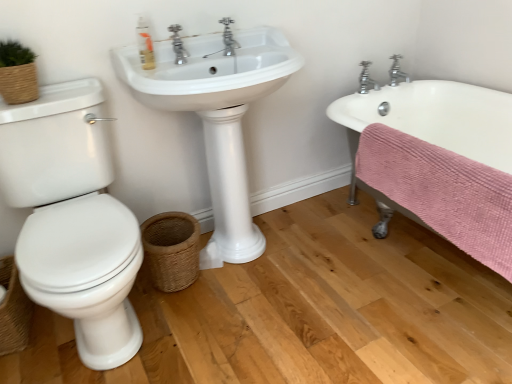
Question: In terms of size, does woven brown basket at lower center, arranged as the 2th basket when viewed from the left, appear bigger or smaller than chrome metallic faucet at upper right, which appears as the 3th tap when viewed from the front?

Choices:
 (A) big
 (B) small

Answer: (A)

Question: In terms of width, does woven brown basket at lower center, arranged as the 2th basket when viewed from the left, look wider or thinner when compared to chrome metallic faucet at upper right, which appears as the 3th tap when viewed from the front?

Choices:
 (A) wide
 (B) thin

Answer: (A)

Question: Which is farther from the chrome metallic faucet at upper center, the 3th tap when ordered from right to left?

Choices:
 (A) chrome metallic faucet at upper right, which is counted as the 3th tap, starting from the left
 (B) woven brown basket at lower left, which is the 1th basket in left-to-right order
 (C) pink textured towel at lower right
 (D) woven brown basket at lower center, arranged as the 2th basket when viewed from the left
 (E) white glossy sink at center

Answer: (B)

Question: Considering the real-world distances, which object is closest to the chrome metallic faucet at upper center, which is the first tap in front-to-back order?

Choices:
 (A) woven brown basket at lower left, marked as the second basket in a right-to-left arrangement
 (B) woven brown basket at lower center, acting as the 1th basket starting from the right
 (C) translucent plastic soap dispenser at upper center
 (D) chrome metallic faucet at upper right, which is counted as the 3th tap, starting from the left
 (E) silver metallic faucet at upper right, arranged as the second tap when viewed from the left

Answer: (C)